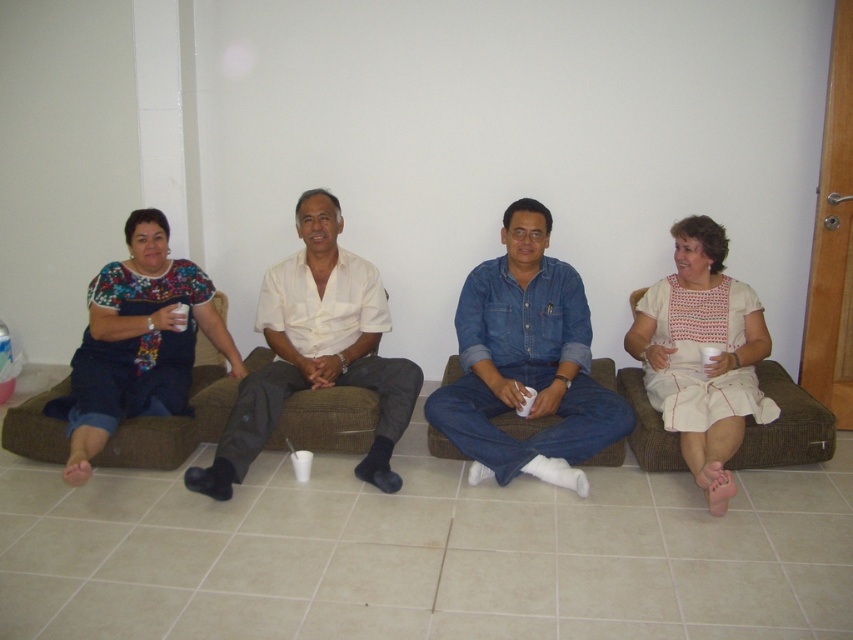
Question: Does white embroidered dress at right come in front of floral fabric dress at left?

Choices:
 (A) yes
 (B) no

Answer: (A)

Question: Which point is closer to the camera taking this photo?

Choices:
 (A) (715, 244)
 (B) (473, 460)

Answer: (B)

Question: Based on their relative distances, which object is nearer to the white embroidered dress at right?

Choices:
 (A) floral fabric dress at left
 (B) white cotton shirt at center
 (C) brown fabric couch at center
 (D) denim shirt at center

Answer: (D)

Question: Where is white cotton shirt at center located in relation to floral fabric dress at left in the image?

Choices:
 (A) above
 (B) below

Answer: (A)

Question: Does white cotton shirt at center have a larger size compared to brown fabric couch at right?

Choices:
 (A) no
 (B) yes

Answer: (B)

Question: Which point is closer to the camera?

Choices:
 (A) click(770, 392)
 (B) click(219, 465)
 (C) click(167, 384)
 (D) click(762, 337)

Answer: (B)